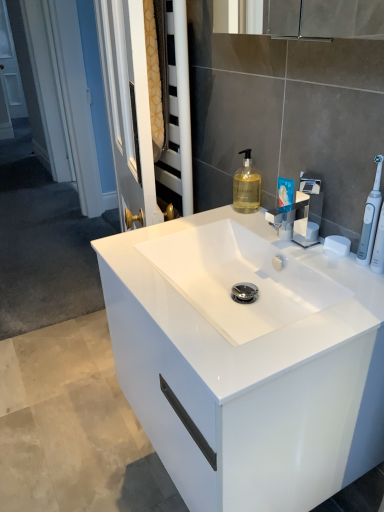
I want to click on free space in front of white plastic toothbrush at right, so click(x=355, y=298).